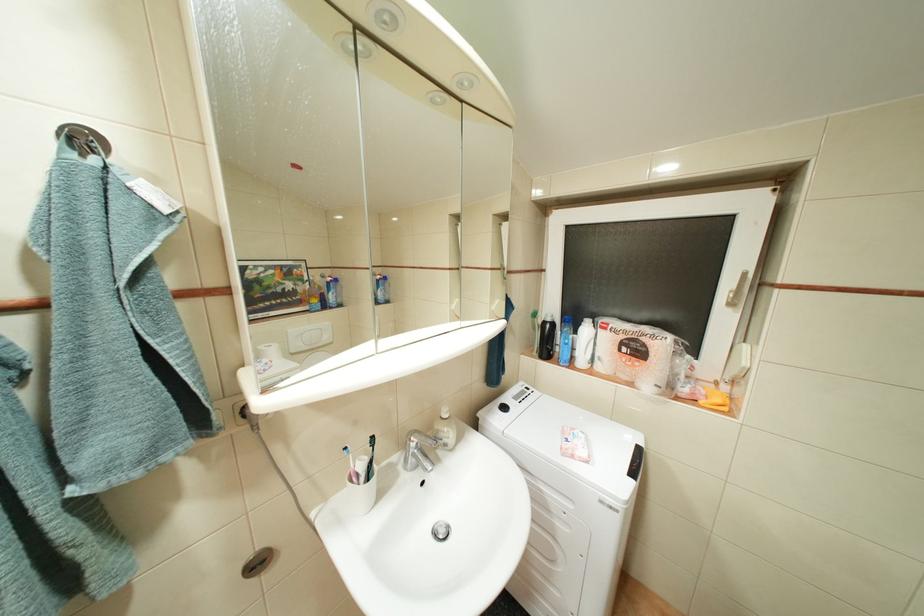
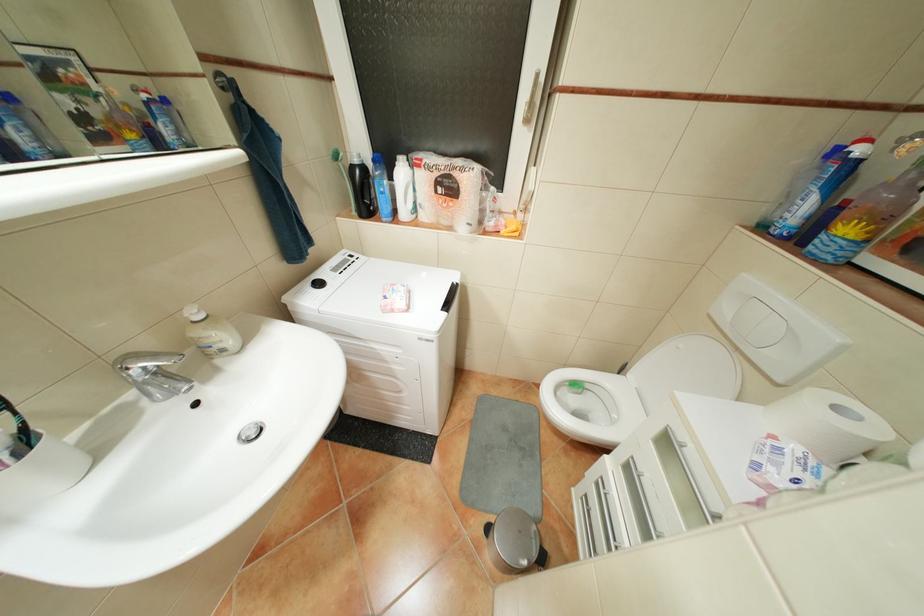
Where in the second image is the point corresponding to (x=563, y=323) from the first image?

(373, 167)